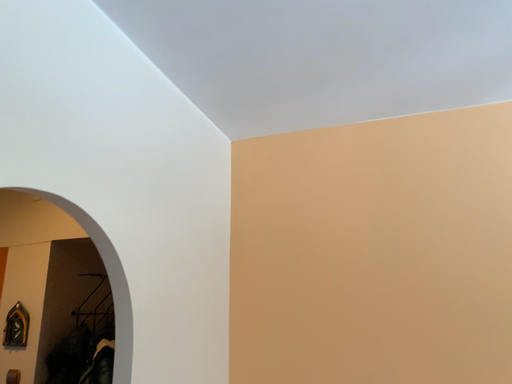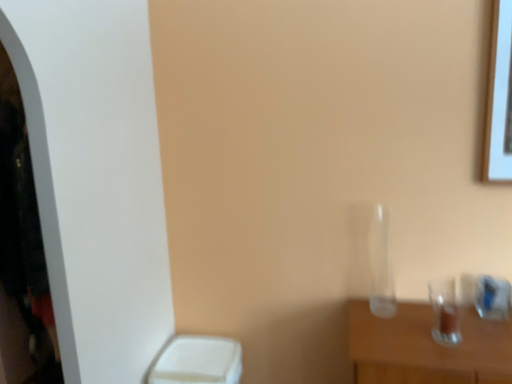
Question: Which way did the camera rotate in the video?

Choices:
 (A) rotated downward
 (B) rotated upward

Answer: (A)